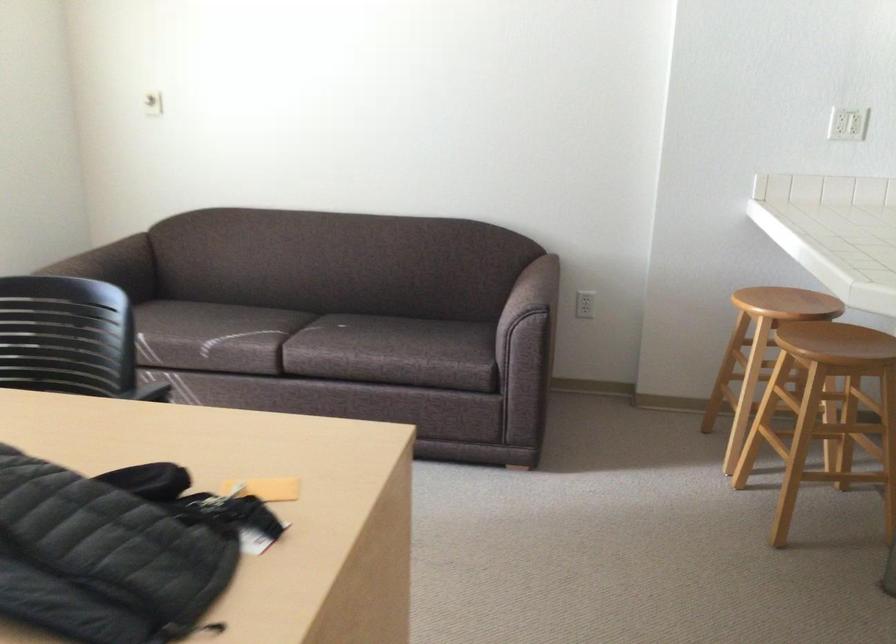
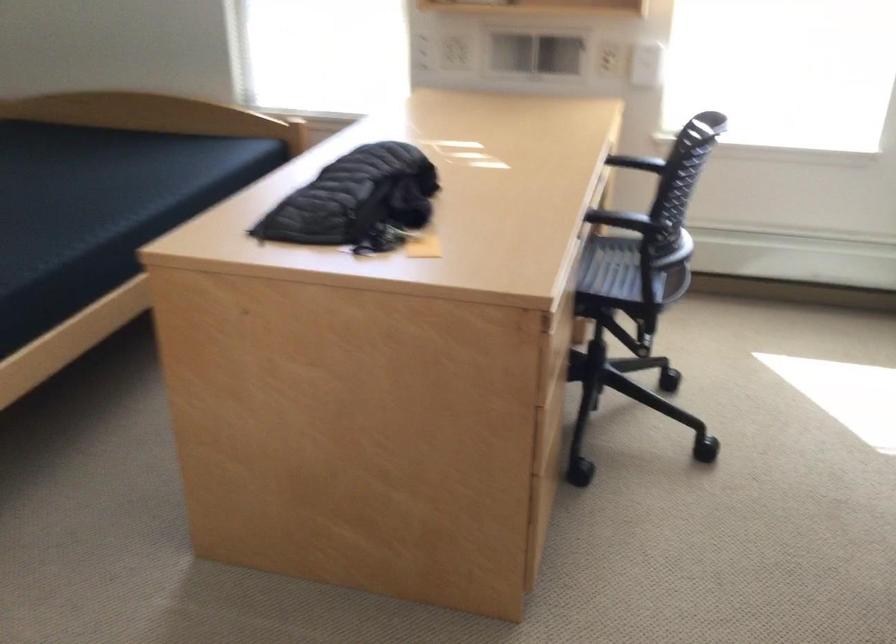
The point at (x=134, y=406) is marked in the first image. Where is the corresponding point in the second image?

(597, 216)